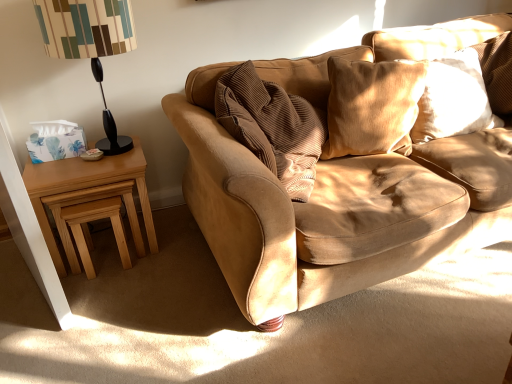
Question: In terms of width, does light brown wood nesting tables at left look wider or thinner when compared to black plastic table lamp at left?

Choices:
 (A) thin
 (B) wide

Answer: (B)

Question: Is point (49, 165) closer or farther from the camera than point (80, 29)?

Choices:
 (A) farther
 (B) closer

Answer: (A)

Question: Estimate the real-world distances between objects in this image. Which object is farther from the black plastic table lamp at left?

Choices:
 (A) white satin pillow at upper right, positioned as the first pillow in right-to-left order
 (B) light brown wood nesting tables at left
 (C) light brown wooden stool at lower left
 (D) suede cushion at upper right, the second pillow when ordered from right to left

Answer: (A)

Question: Which object is the closest to the suede cushion at upper right, marked as the first pillow in a left-to-right arrangement?

Choices:
 (A) white satin pillow at upper right, the second pillow from the left
 (B) light brown wood nesting tables at left
 (C) black plastic table lamp at left
 (D) light brown wooden stool at lower left

Answer: (A)